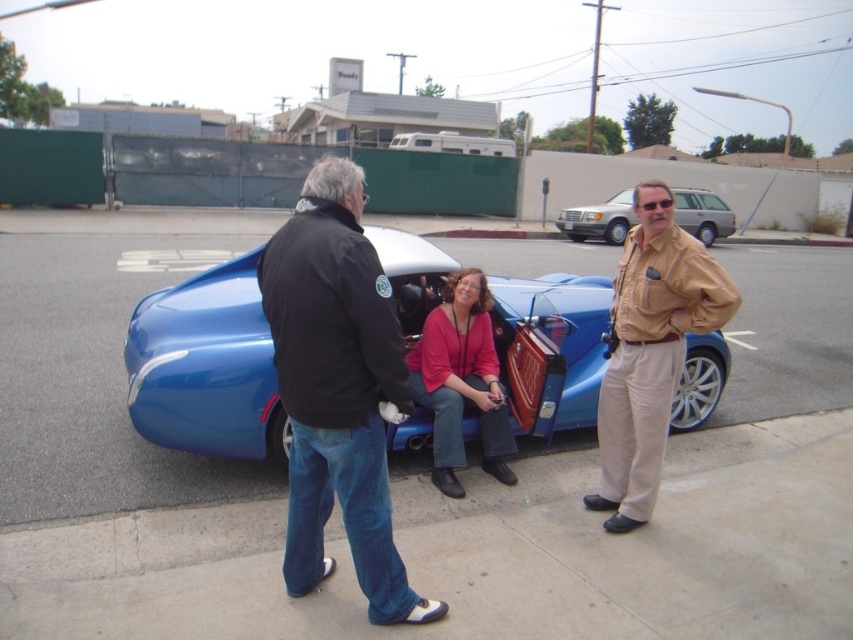
Is shiny metallic car at center shorter than silver metallic suv at upper right?

In fact, shiny metallic car at center may be taller than silver metallic suv at upper right.

Which of these two, shiny metallic car at center or silver metallic suv at upper right, stands shorter?

silver metallic suv at upper right

Does point (529, 387) lie behind point (628, 216)?

No, it is not.

The width and height of the screenshot is (853, 640). Identify the location of shiny metallic car at center. (206, 365).

Is black leather jacket at center further to the viewer compared to tan leather jacket at right?

No, black leather jacket at center is closer to the viewer.

In order to click on black leather jacket at center in this screenshot , I will do `click(337, 388)`.

Based on the photo, who is more forward, (305,346) or (630,506)?

Point (305,346)

Where is `black leather jacket at center`? black leather jacket at center is located at coordinates (337, 388).

Is shiny metallic car at center positioned behind matte pink sweater at center?

Yes, shiny metallic car at center is further from the viewer.

Does point (419, 317) lie behind point (428, 340)?

Yes, point (419, 317) is farther from viewer.

Identify the location of shiny metallic car at center. (206, 365).